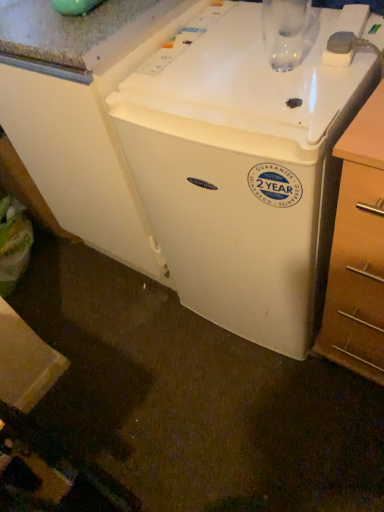
Question: Is wooden at right touching white plastic refrigerator at center?

Choices:
 (A) yes
 (B) no

Answer: (B)

Question: From the image's perspective, would you say wooden at right is shown under white plastic refrigerator at center?

Choices:
 (A) no
 (B) yes

Answer: (B)

Question: Does wooden at right appear on the right side of white plastic refrigerator at center?

Choices:
 (A) no
 (B) yes

Answer: (B)

Question: Does wooden at right have a lesser width compared to white plastic refrigerator at center?

Choices:
 (A) no
 (B) yes

Answer: (B)

Question: Is wooden at right at the left side of white plastic refrigerator at center?

Choices:
 (A) yes
 (B) no

Answer: (B)

Question: Is wooden at right further to the viewer compared to white plastic refrigerator at center?

Choices:
 (A) yes
 (B) no

Answer: (B)

Question: From a real-world perspective, is white plastic refrigerator at center below wooden at right?

Choices:
 (A) yes
 (B) no

Answer: (B)

Question: Can you confirm if white plastic refrigerator at center is wider than wooden at right?

Choices:
 (A) yes
 (B) no

Answer: (A)

Question: Does white plastic refrigerator at center have a greater height compared to wooden at right?

Choices:
 (A) no
 (B) yes

Answer: (B)

Question: Can you confirm if white plastic refrigerator at center is positioned to the left of wooden at right?

Choices:
 (A) no
 (B) yes

Answer: (B)

Question: Is white plastic refrigerator at center bigger than wooden at right?

Choices:
 (A) yes
 (B) no

Answer: (A)

Question: Does white plastic refrigerator at center come in front of wooden at right?

Choices:
 (A) no
 (B) yes

Answer: (A)

Question: Is wooden at right inside the boundaries of white plastic refrigerator at center, or outside?

Choices:
 (A) inside
 (B) outside

Answer: (B)